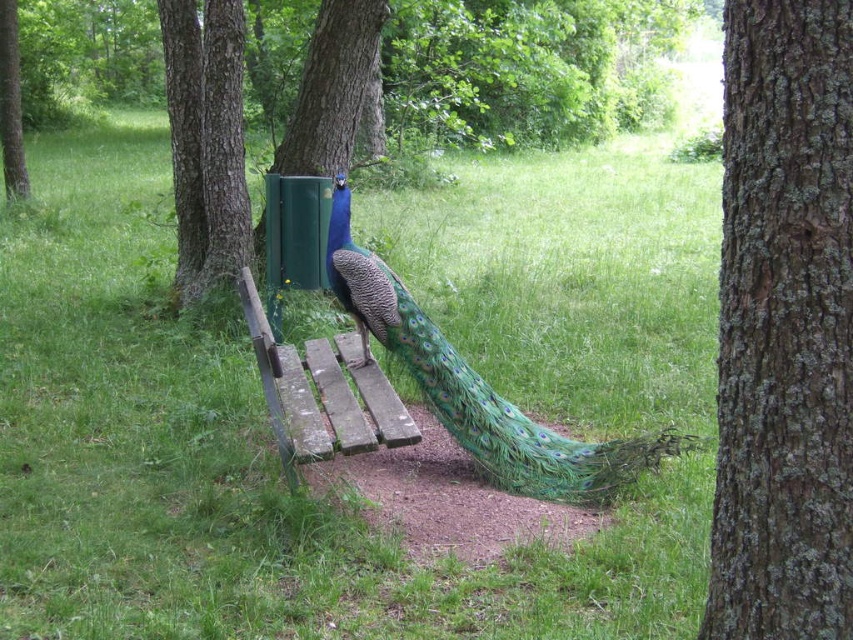
Does green textured box at upper center have a greater height compared to green bark tree at left?

No.

Is point (328, 38) closer to viewer compared to point (4, 92)?

That is True.

Is point (335, 16) more distant than point (13, 145)?

No, (335, 16) is in front of (13, 145).

At what (x,y) coordinates should I click in order to perform the action: click on green textured box at upper center. Please return your answer as a coordinate pair (x, y). The width and height of the screenshot is (853, 640). Looking at the image, I should click on (331, 88).

Who is more distant from viewer, (747, 390) or (207, 140)?

The point (207, 140) is more distant.

What are the coordinates of `rough bark tree at center` in the screenshot? It's located at point(784,326).

Is point (837, 628) farther from viewer compared to point (199, 177)?

No, it is in front of (199, 177).

Find the location of `rough bark tree at center`. rough bark tree at center is located at coordinates (784, 326).

Between weathered wood bench at center and green textured box at upper center, which one has less height?

Standing shorter between the two is weathered wood bench at center.

Consider the image. Which is more to the right, weathered wood bench at center or green textured box at upper center?

Positioned to the right is weathered wood bench at center.

Is point (334, 410) less distant than point (311, 81)?

Yes.

Locate an element on the screen. The height and width of the screenshot is (640, 853). weathered wood bench at center is located at coordinates (321, 394).